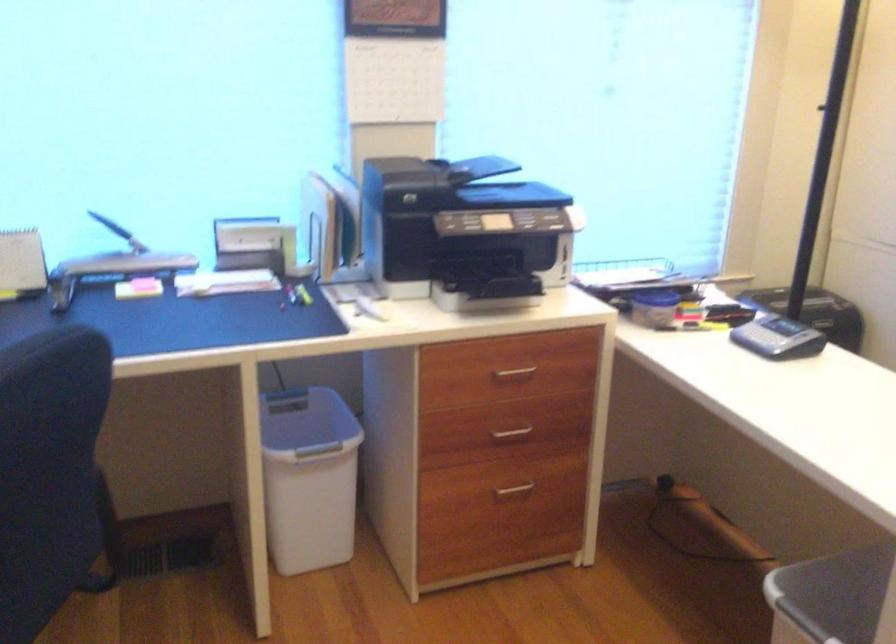
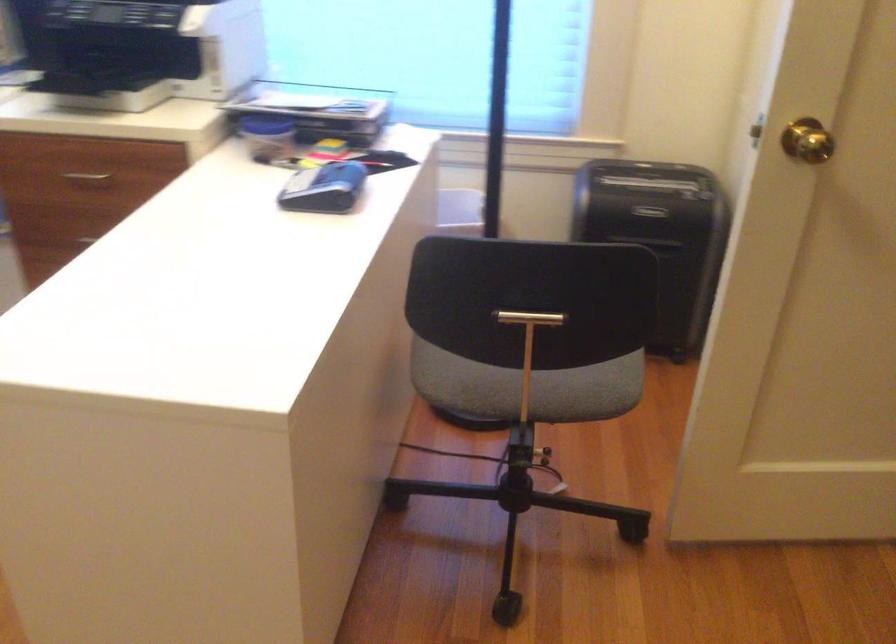
Question: What movement of the cameraman would produce the second image?

Choices:
 (A) Left
 (B) Right
 (C) Forward
 (D) Backward

Answer: (B)